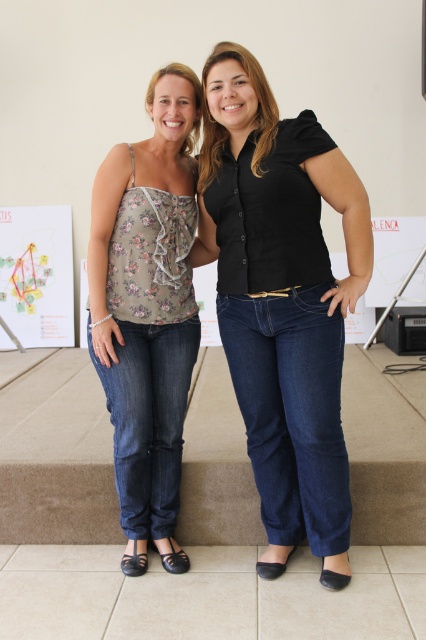
Question: Does black matte shirt at center have a greater width compared to floral print fabric top at center?

Choices:
 (A) no
 (B) yes

Answer: (B)

Question: Which point is closer to the camera taking this photo?

Choices:
 (A) (319, 268)
 (B) (118, 451)

Answer: (A)

Question: Which point is closer to the camera taking this photo?

Choices:
 (A) (187, 289)
 (B) (282, 285)

Answer: (B)

Question: Does black matte shirt at center lie in front of floral print fabric top at center?

Choices:
 (A) yes
 (B) no

Answer: (A)

Question: Is black matte shirt at center thinner than floral print fabric top at center?

Choices:
 (A) no
 (B) yes

Answer: (A)

Question: Among these points, which one is farthest from the camera?

Choices:
 (A) (342, 340)
 (B) (143, 310)

Answer: (B)